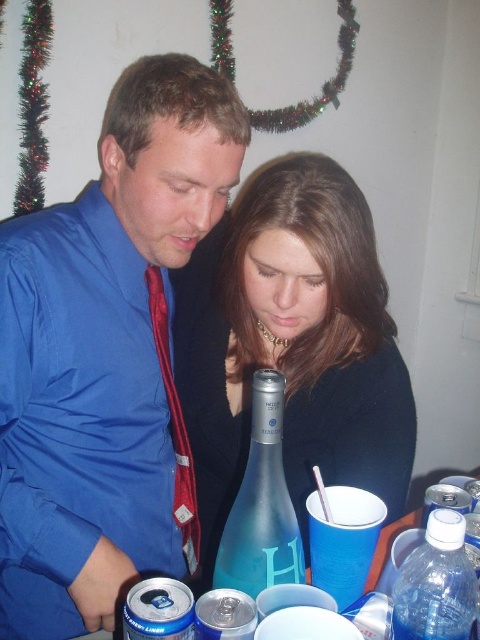
What is located at the coordinates point [107,356]?

The blue satin shirt at center is located at point [107,356].

You are a photographer setting up a shoot at the table. You need to place a small decorative item between the blue satin shirt at center and the blue glass bottle at center. Based on their heights, which object should the item be placed closer to?

The blue satin shirt at center is taller than the blue glass bottle at center, so the decorative item should be placed closer to the blue glass bottle at center to maintain visual balance.

You are a photographer setting up for a portrait. You need to ensure that the blue satin shirt at center and the blue glass bottle at center are both visible in the frame. Based on their positions, which object should you focus on first to ensure both are in focus?

The blue satin shirt at center is above the blue glass bottle at center, so focusing on the shirt first will help ensure both are in focus as they are vertically aligned.